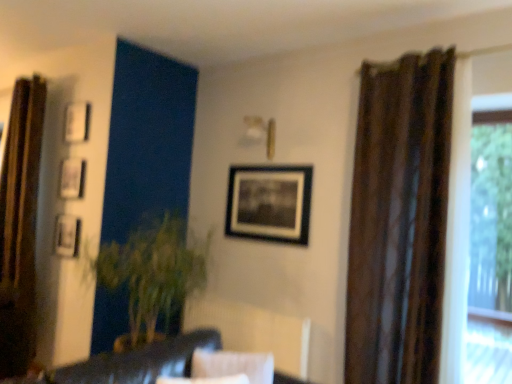
Find the location of a particular element. metallic silver picture frame at upper left, which is counted as the fourth picture frame, starting from the right is located at coordinates (67, 235).

Where is `brown textured curtain at left, which appears as the first curtain when viewed from the back`? The width and height of the screenshot is (512, 384). brown textured curtain at left, which appears as the first curtain when viewed from the back is located at coordinates (20, 226).

This screenshot has width=512, height=384. I want to click on white matte picture frame at upper left, the second picture frame when ordered from right to left, so click(x=76, y=122).

Measure the distance between white matte picture frame at upper left, the second picture frame when ordered from right to left, and camera.

3.49 meters.

Locate an element on the screen. The image size is (512, 384). brown textured curtain at right, placed as the 2th curtain when sorted from left to right is located at coordinates (399, 220).

Describe the element at coordinates (269, 203) in the screenshot. The image size is (512, 384). I see `black matte picture frame at center, placed as the 4th picture frame when sorted from left to right` at that location.

This screenshot has width=512, height=384. What do you see at coordinates (133, 363) in the screenshot?
I see `dark brown leather couch at lower center` at bounding box center [133, 363].

Locate an element on the screen. The width and height of the screenshot is (512, 384). metallic silver picture frame at upper left, which is counted as the fourth picture frame, starting from the right is located at coordinates (x=67, y=235).

From a real-world perspective, who is located lower, brown textured curtain at left, which appears as the first curtain when viewed from the back, or matte black picture frame at upper left, arranged as the 3th picture frame when viewed from the right?

From a 3D spatial view, brown textured curtain at left, which appears as the first curtain when viewed from the back, is below.

Does brown textured curtain at left, which appears as the first curtain when viewed from the back, have a larger size compared to matte black picture frame at upper left, arranged as the 3th picture frame when viewed from the right?

Indeed, brown textured curtain at left, which appears as the first curtain when viewed from the back, has a larger size compared to matte black picture frame at upper left, arranged as the 3th picture frame when viewed from the right.

In the scene shown: From the image's perspective, does brown textured curtain at left, the 2th curtain positioned from the front, appear higher than matte black picture frame at upper left, which appears as the second picture frame when viewed from the left?

No.

From a real-world perspective, between white matte picture frame at upper left, the second picture frame when ordered from right to left, and black matte picture frame at center, placed as the 4th picture frame when sorted from left to right, who is vertically lower?

black matte picture frame at center, placed as the 4th picture frame when sorted from left to right.

Between white matte picture frame at upper left, placed as the third picture frame when sorted from left to right, and black matte picture frame at center, arranged as the 1th picture frame when viewed from the right, which one has smaller width?

black matte picture frame at center, arranged as the 1th picture frame when viewed from the right, is thinner.

Does white matte picture frame at upper left, placed as the third picture frame when sorted from left to right, have a larger size compared to black matte picture frame at center, arranged as the 1th picture frame when viewed from the right?

Actually, white matte picture frame at upper left, placed as the third picture frame when sorted from left to right, might be smaller than black matte picture frame at center, arranged as the 1th picture frame when viewed from the right.

Between white matte picture frame at upper left, placed as the third picture frame when sorted from left to right, and black matte picture frame at center, arranged as the 1th picture frame when viewed from the right, which one has less height?

Standing shorter between the two is white matte picture frame at upper left, placed as the third picture frame when sorted from left to right.

Can you confirm if brown textured curtain at right, placed as the 2th curtain when sorted from left to right, is smaller than dark brown leather couch at lower center?

Indeed, brown textured curtain at right, placed as the 2th curtain when sorted from left to right, has a smaller size compared to dark brown leather couch at lower center.

Would you say brown textured curtain at right, which appears as the 1th curtain when viewed from the right, contains dark brown leather couch at lower center?

Definitely not — dark brown leather couch at lower center is not inside brown textured curtain at right, which appears as the 1th curtain when viewed from the right.

Can you confirm if brown textured curtain at right, the first curtain from the front, is taller than dark brown leather couch at lower center?

Indeed, brown textured curtain at right, the first curtain from the front, has a greater height compared to dark brown leather couch at lower center.

Considering the sizes of objects brown textured curtain at right, which appears as the 1th curtain when viewed from the right, and dark brown leather couch at lower center in the image provided, who is wider, brown textured curtain at right, which appears as the 1th curtain when viewed from the right, or dark brown leather couch at lower center?

With larger width is dark brown leather couch at lower center.

Which object is positioned more to the left, matte black picture frame at upper left, which appears as the second picture frame when viewed from the left, or white matte picture frame at upper left, placed as the third picture frame when sorted from left to right?

From the viewer's perspective, matte black picture frame at upper left, which appears as the second picture frame when viewed from the left, appears more on the left side.

Is matte black picture frame at upper left, arranged as the 3th picture frame when viewed from the right, in contact with white matte picture frame at upper left, the second picture frame when ordered from right to left?

No, matte black picture frame at upper left, arranged as the 3th picture frame when viewed from the right, is not in contact with white matte picture frame at upper left, the second picture frame when ordered from right to left.

From the image's perspective, who appears lower, matte black picture frame at upper left, which appears as the second picture frame when viewed from the left, or white matte picture frame at upper left, the second picture frame when ordered from right to left?

matte black picture frame at upper left, which appears as the second picture frame when viewed from the left, from the image's perspective.

Considering the sizes of objects black matte picture frame at center, placed as the 4th picture frame when sorted from left to right, and brown textured curtain at right, positioned as the second curtain in back-to-front order, in the image provided, who is thinner, black matte picture frame at center, placed as the 4th picture frame when sorted from left to right, or brown textured curtain at right, positioned as the second curtain in back-to-front order,?

With smaller width is black matte picture frame at center, placed as the 4th picture frame when sorted from left to right.

Which object is closer to the camera, black matte picture frame at center, arranged as the 1th picture frame when viewed from the right, or brown textured curtain at right, which appears as the 1th curtain when viewed from the right?

Positioned in front is brown textured curtain at right, which appears as the 1th curtain when viewed from the right.

Consider the image. Do you think metallic silver picture frame at upper left, marked as the 1th picture frame in a left-to-right arrangement, is within brown textured curtain at left, which is the second curtain from right to left, or outside of it?

metallic silver picture frame at upper left, marked as the 1th picture frame in a left-to-right arrangement, is not inside brown textured curtain at left, which is the second curtain from right to left, it's outside.

Based on the photo, from the image's perspective, is metallic silver picture frame at upper left, marked as the 1th picture frame in a left-to-right arrangement, below brown textured curtain at left, which appears as the first curtain when viewed from the back?

Yes.

In the scene shown: Can you confirm if metallic silver picture frame at upper left, which is counted as the fourth picture frame, starting from the right, is positioned to the left of brown textured curtain at left, the first curtain positioned from the left?

In fact, metallic silver picture frame at upper left, which is counted as the fourth picture frame, starting from the right, is to the right of brown textured curtain at left, the first curtain positioned from the left.

Which of these two, metallic silver picture frame at upper left, marked as the 1th picture frame in a left-to-right arrangement, or brown textured curtain at left, which is the second curtain from right to left, is bigger?

brown textured curtain at left, which is the second curtain from right to left, is bigger.

Is white matte picture frame at upper left, the second picture frame when ordered from right to left, closer to the viewer compared to brown textured curtain at right, placed as the 2th curtain when sorted from left to right?

No, white matte picture frame at upper left, the second picture frame when ordered from right to left, is further to the viewer.

Is white matte picture frame at upper left, the second picture frame when ordered from right to left, to the left or to the right of brown textured curtain at right, placed as the 2th curtain when sorted from left to right, in the image?

In the image, white matte picture frame at upper left, the second picture frame when ordered from right to left, appears on the left side of brown textured curtain at right, placed as the 2th curtain when sorted from left to right.

Looking at this image, is white matte picture frame at upper left, the second picture frame when ordered from right to left, oriented towards brown textured curtain at right, positioned as the second curtain in back-to-front order?

No, white matte picture frame at upper left, the second picture frame when ordered from right to left, does not turn towards brown textured curtain at right, positioned as the second curtain in back-to-front order.

From a real-world perspective, is white matte picture frame at upper left, placed as the third picture frame when sorted from left to right, below brown textured curtain at right, which appears as the 1th curtain when viewed from the right?

Actually, white matte picture frame at upper left, placed as the third picture frame when sorted from left to right, is physically above brown textured curtain at right, which appears as the 1th curtain when viewed from the right, in the real world.

The height and width of the screenshot is (384, 512). What are the coordinates of `the 1st curtain below the matte black picture frame at upper left, which appears as the second picture frame when viewed from the left (from the image's perspective)` in the screenshot? It's located at (20, 226).

From a real-world perspective, count 2nd picture frames upward from the black matte picture frame at center, arranged as the 1th picture frame when viewed from the right, and point to it. Please provide its 2D coordinates.

[(76, 122)]

Which object lies nearer to the anchor point dark brown leather couch at lower center, metallic silver picture frame at upper left, marked as the 1th picture frame in a left-to-right arrangement, or brown textured curtain at left, the 2th curtain positioned from the front?

metallic silver picture frame at upper left, marked as the 1th picture frame in a left-to-right arrangement, is positioned closer to the anchor dark brown leather couch at lower center.

Which object lies further to the anchor point brown textured curtain at right, which appears as the 1th curtain when viewed from the right, matte black picture frame at upper left, arranged as the 3th picture frame when viewed from the right, or metallic silver picture frame at upper left, marked as the 1th picture frame in a left-to-right arrangement?

The object further to brown textured curtain at right, which appears as the 1th curtain when viewed from the right, is matte black picture frame at upper left, arranged as the 3th picture frame when viewed from the right.

Looking at the image, which one is located further to white matte picture frame at upper left, placed as the third picture frame when sorted from left to right, brown textured curtain at right, placed as the 2th curtain when sorted from left to right, or metallic silver picture frame at upper left, marked as the 1th picture frame in a left-to-right arrangement?

brown textured curtain at right, placed as the 2th curtain when sorted from left to right.

Considering their positions, is white matte picture frame at upper left, placed as the third picture frame when sorted from left to right, positioned further to matte black picture frame at upper left, which appears as the second picture frame when viewed from the left, than black matte picture frame at center, arranged as the 1th picture frame when viewed from the right?

Based on the image, black matte picture frame at center, arranged as the 1th picture frame when viewed from the right, appears to be further to matte black picture frame at upper left, which appears as the second picture frame when viewed from the left.

Estimate the real-world distances between objects in this image. Which object is further from dark brown leather couch at lower center, metallic silver picture frame at upper left, marked as the 1th picture frame in a left-to-right arrangement, or black matte picture frame at center, placed as the 4th picture frame when sorted from left to right?

Based on the image, metallic silver picture frame at upper left, marked as the 1th picture frame in a left-to-right arrangement, appears to be further to dark brown leather couch at lower center.

Estimate the real-world distances between objects in this image. Which object is closer to white matte picture frame at upper left, the second picture frame when ordered from right to left, brown textured curtain at right, placed as the 2th curtain when sorted from left to right, or black matte picture frame at center, arranged as the 1th picture frame when viewed from the right?

black matte picture frame at center, arranged as the 1th picture frame when viewed from the right, lies closer to white matte picture frame at upper left, the second picture frame when ordered from right to left, than the other object.

From the image, which object appears to be farther from matte black picture frame at upper left, which appears as the second picture frame when viewed from the left, brown textured curtain at right, positioned as the second curtain in back-to-front order, or white matte picture frame at upper left, placed as the third picture frame when sorted from left to right?

The object further to matte black picture frame at upper left, which appears as the second picture frame when viewed from the left, is brown textured curtain at right, positioned as the second curtain in back-to-front order.

Consider the image. From the image, which object appears to be farther from matte black picture frame at upper left, arranged as the 3th picture frame when viewed from the right, brown textured curtain at right, positioned as the second curtain in back-to-front order, or dark brown leather couch at lower center?

brown textured curtain at right, positioned as the second curtain in back-to-front order, is further to matte black picture frame at upper left, arranged as the 3th picture frame when viewed from the right.

Find the location of a particular element. The width and height of the screenshot is (512, 384). couch between brown textured curtain at left, the 2th curtain positioned from the front, and brown textured curtain at right, the first curtain from the front, in the horizontal direction is located at coordinates (133, 363).

The width and height of the screenshot is (512, 384). Identify the location of picture frame between dark brown leather couch at lower center and metallic silver picture frame at upper left, which is counted as the fourth picture frame, starting from the right, along the z-axis. (269, 203).

At what (x,y) coordinates should I click in order to perform the action: click on picture frame between dark brown leather couch at lower center and brown textured curtain at left, which appears as the first curtain when viewed from the back, along the z-axis. Please return your answer as a coordinate pair (x, y). Looking at the image, I should click on (269, 203).

Locate an element on the screen. curtain between dark brown leather couch at lower center and black matte picture frame at center, arranged as the 1th picture frame when viewed from the right, along the z-axis is located at coordinates (399, 220).